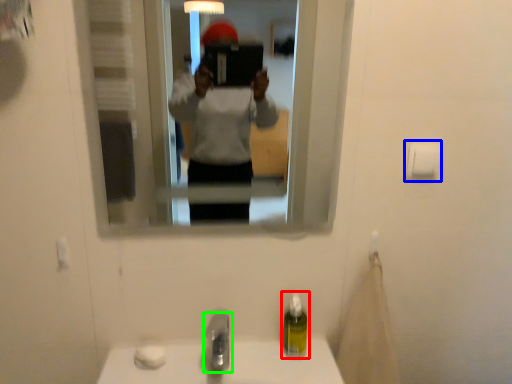
Question: Estimate the real-world distances between objects in this image. Which object is farther from soap dispenser (highlighted by a red box), toilet paper (highlighted by a blue box) or tap (highlighted by a green box)?

Choices:
 (A) toilet paper
 (B) tap

Answer: (A)